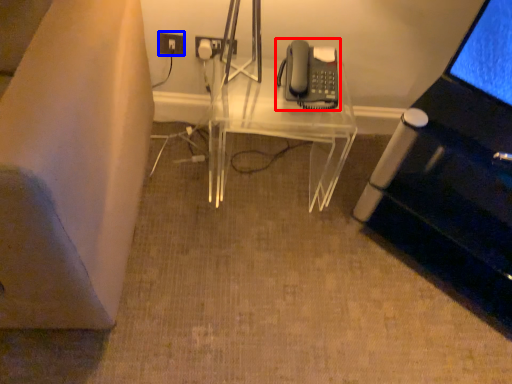
Question: Which object appears farthest to the camera in this image, corded phone (highlighted by a red box) or electric outlet (highlighted by a blue box)?

Choices:
 (A) corded phone
 (B) electric outlet

Answer: (B)